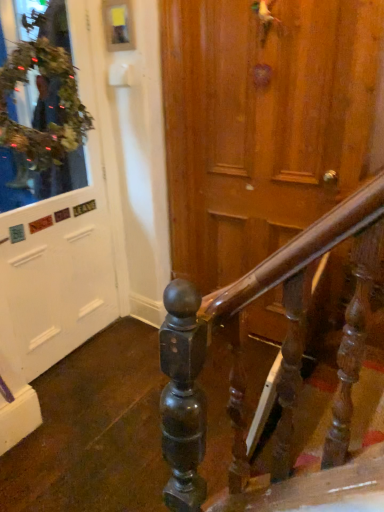
Question: From a real-world perspective, does green leafy wreath at upper left sit lower than white matte door at left?

Choices:
 (A) no
 (B) yes

Answer: (A)

Question: Does green leafy wreath at upper left have a lesser height compared to white matte door at left?

Choices:
 (A) no
 (B) yes

Answer: (B)

Question: Is green leafy wreath at upper left oriented towards white matte door at left?

Choices:
 (A) yes
 (B) no

Answer: (B)

Question: Considering the relative positions of green leafy wreath at upper left and white matte door at left in the image provided, is green leafy wreath at upper left to the right of white matte door at left from the viewer's perspective?

Choices:
 (A) yes
 (B) no

Answer: (A)

Question: Does green leafy wreath at upper left have a larger size compared to white matte door at left?

Choices:
 (A) yes
 (B) no

Answer: (B)

Question: Can you confirm if green leafy wreath at upper left is thinner than white matte door at left?

Choices:
 (A) yes
 (B) no

Answer: (B)

Question: From the image's perspective, would you say white matte door at left is shown under green leafy wreath at upper left?

Choices:
 (A) no
 (B) yes

Answer: (B)

Question: Can you confirm if white matte door at left is smaller than green leafy wreath at upper left?

Choices:
 (A) yes
 (B) no

Answer: (B)

Question: Is white matte door at left thinner than green leafy wreath at upper left?

Choices:
 (A) yes
 (B) no

Answer: (A)

Question: From a real-world perspective, does white matte door at left sit lower than green leafy wreath at upper left?

Choices:
 (A) no
 (B) yes

Answer: (B)

Question: Is white matte door at left far away from green leafy wreath at upper left?

Choices:
 (A) no
 (B) yes

Answer: (A)

Question: Can we say white matte door at left lies outside green leafy wreath at upper left?

Choices:
 (A) yes
 (B) no

Answer: (A)

Question: Based on their positions, is white matte door at left located to the left or right of green leafy wreath at upper left?

Choices:
 (A) right
 (B) left

Answer: (B)